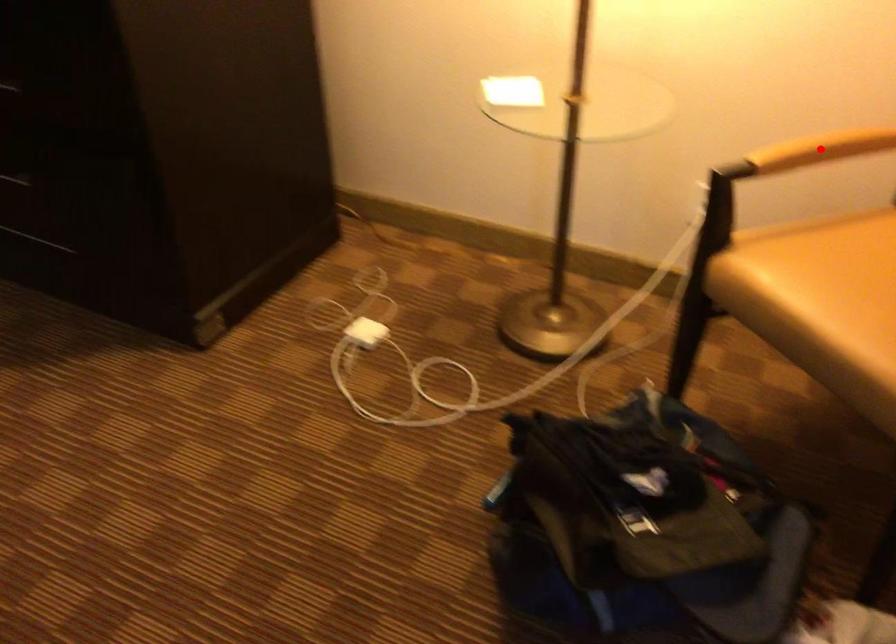
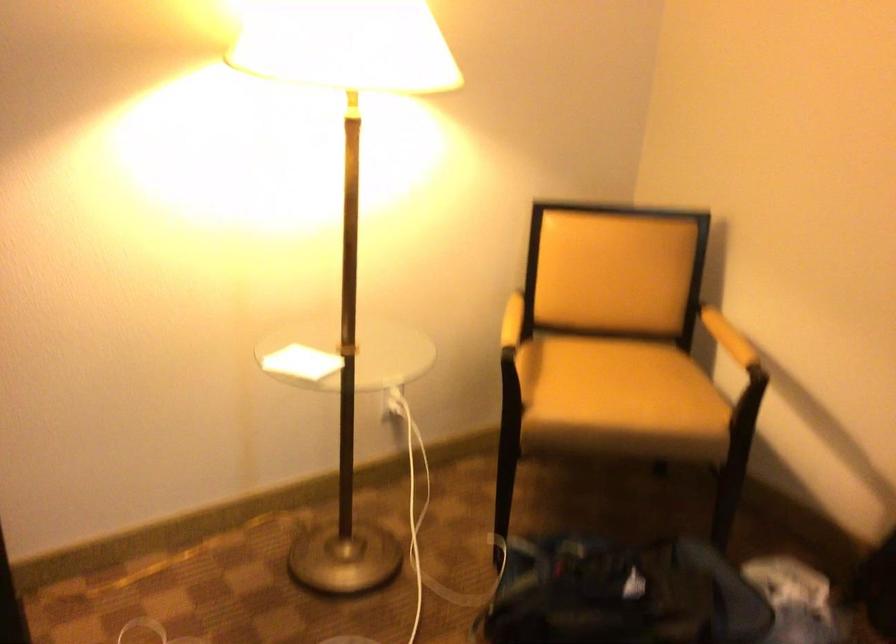
Find the pixel in the second image that matches the highlighted location in the first image.

(528, 319)